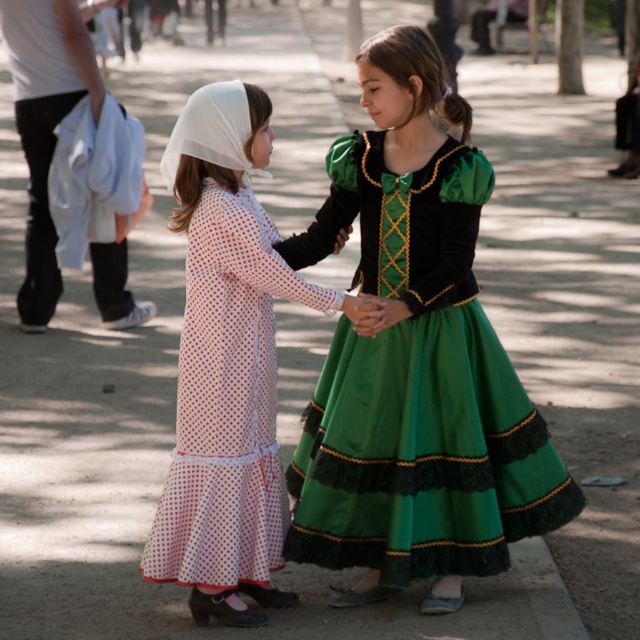
Who is shorter, white dotted fabric dress at left or white cotton shirt at left?

Standing shorter between the two is white dotted fabric dress at left.

Between white dotted fabric dress at left and white cotton shirt at left, which one is positioned lower?

white dotted fabric dress at left is below.

Is point (195, 520) closer to viewer compared to point (90, 92)?

Yes, point (195, 520) is closer to viewer.

Find the location of `white dotted fabric dress at left`. white dotted fabric dress at left is located at coordinates (227, 403).

Image resolution: width=640 pixels, height=640 pixels. I want to click on green satin dress at center, so click(x=417, y=388).

What do you see at coordinates (417, 388) in the screenshot?
I see `green satin dress at center` at bounding box center [417, 388].

Identify the location of green satin dress at center. The height and width of the screenshot is (640, 640). (417, 388).

Is green satin dress at center wider than white cotton shirt at left?

Correct, the width of green satin dress at center exceeds that of white cotton shirt at left.

Is point (394, 436) farther from viewer compared to point (28, 216)?

No, it is in front of (28, 216).

Between point (356, 557) and point (3, 38), which one is positioned behind?

The point (3, 38) is more distant.

The height and width of the screenshot is (640, 640). In order to click on green satin dress at center in this screenshot , I will do `click(417, 388)`.